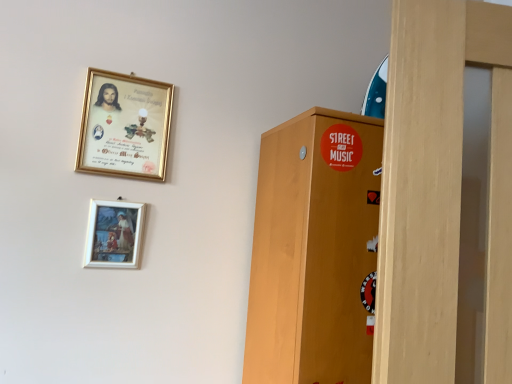
Question: From their relative heights in the image, would you say matte wooden picture frame at lower center, which ranks as the first picture frame in bottom-to-top order, is taller or shorter than gold-framed picture at upper left, the 2th picture frame in the bottom-to-top sequence?

Choices:
 (A) short
 (B) tall

Answer: (A)

Question: From the image's perspective, is matte wooden picture frame at lower center, which ranks as the first picture frame in bottom-to-top order, above or below gold-framed picture at upper left, the 2th picture frame in the bottom-to-top sequence?

Choices:
 (A) below
 (B) above

Answer: (A)

Question: In terms of width, does matte wooden picture frame at lower center, placed as the second picture frame when sorted from top to bottom, look wider or thinner when compared to gold-framed picture at upper left, marked as the first picture frame in a top-to-bottom arrangement?

Choices:
 (A) wide
 (B) thin

Answer: (B)

Question: Visually, is gold-framed picture at upper left, the 2th picture frame in the bottom-to-top sequence, positioned to the left or to the right of matte wooden picture frame at lower center, which ranks as the first picture frame in bottom-to-top order?

Choices:
 (A) right
 (B) left

Answer: (A)

Question: From a real-world perspective, relative to matte wooden picture frame at lower center, which ranks as the first picture frame in bottom-to-top order, is gold-framed picture at upper left, the 2th picture frame in the bottom-to-top sequence, vertically above or below?

Choices:
 (A) below
 (B) above

Answer: (B)

Question: From the image's perspective, relative to matte wooden picture frame at lower center, which ranks as the first picture frame in bottom-to-top order, is gold-framed picture at upper left, the 2th picture frame in the bottom-to-top sequence, above or below?

Choices:
 (A) above
 (B) below

Answer: (A)

Question: Is point (91, 168) closer or farther from the camera than point (138, 203)?

Choices:
 (A) farther
 (B) closer

Answer: (B)